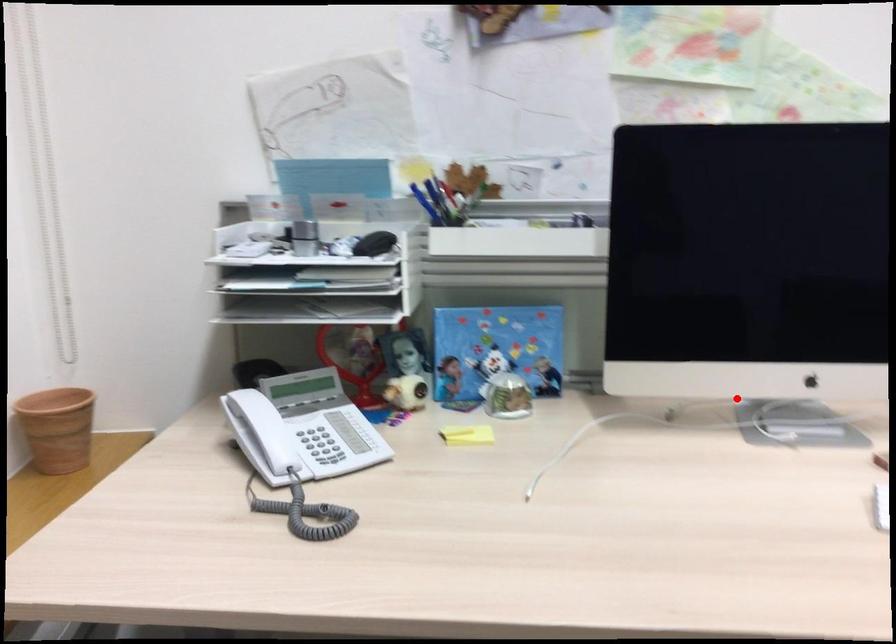
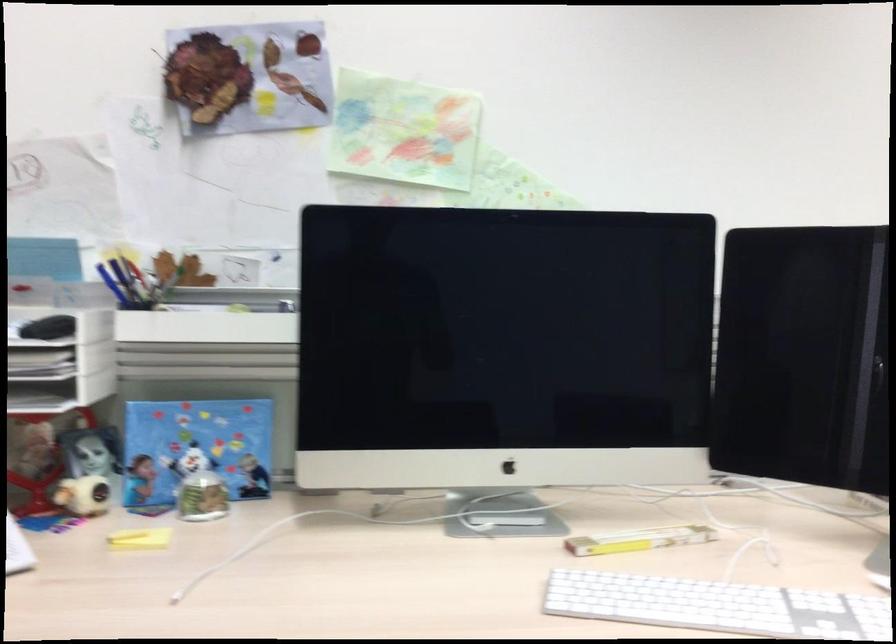
Where in the second image is the point corresponding to the highlighted location from the first image?

(449, 494)